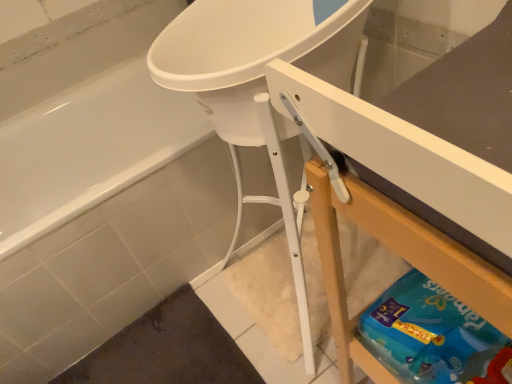
Question: Is white glossy bathtub at upper left taller than blue cardboard box at lower right?

Choices:
 (A) no
 (B) yes

Answer: (B)

Question: Is white glossy bathtub at upper left further to the viewer compared to blue cardboard box at lower right?

Choices:
 (A) no
 (B) yes

Answer: (B)

Question: Would you say white glossy bathtub at upper left is outside blue cardboard box at lower right?

Choices:
 (A) yes
 (B) no

Answer: (A)

Question: Considering the relative sizes of white glossy bathtub at upper left and blue cardboard box at lower right in the image provided, is white glossy bathtub at upper left thinner than blue cardboard box at lower right?

Choices:
 (A) yes
 (B) no

Answer: (B)

Question: Is white glossy bathtub at upper left facing away from blue cardboard box at lower right?

Choices:
 (A) no
 (B) yes

Answer: (A)

Question: From a real-world perspective, is white glossy bathtub at upper left located beneath blue cardboard box at lower right?

Choices:
 (A) yes
 (B) no

Answer: (A)

Question: Is white glossy bathtub at upper left completely or partially inside blue cardboard box at lower right?

Choices:
 (A) yes
 (B) no

Answer: (B)

Question: Is blue cardboard box at lower right wider than white glossy bathtub at upper left?

Choices:
 (A) yes
 (B) no

Answer: (B)

Question: From a real-world perspective, is blue cardboard box at lower right positioned over white glossy bathtub at upper left based on gravity?

Choices:
 (A) yes
 (B) no

Answer: (A)

Question: Is blue cardboard box at lower right facing towards white glossy bathtub at upper left?

Choices:
 (A) yes
 (B) no

Answer: (B)

Question: Is blue cardboard box at lower right facing away from white glossy bathtub at upper left?

Choices:
 (A) no
 (B) yes

Answer: (A)

Question: Is blue cardboard box at lower right at the left side of white glossy bathtub at upper left?

Choices:
 (A) yes
 (B) no

Answer: (B)

Question: In terms of width, does white glossy bathtub at upper left look wider or thinner when compared to blue cardboard box at lower right?

Choices:
 (A) thin
 (B) wide

Answer: (B)